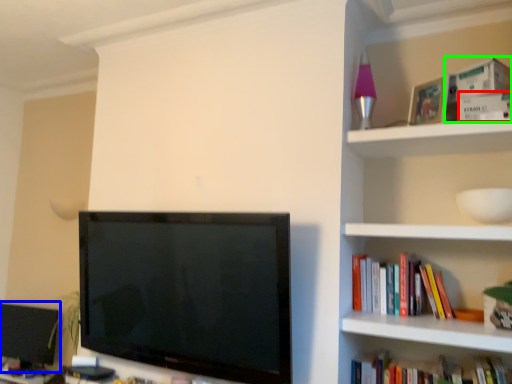
Question: Which object is positioned closest to paperback book (highlighted by a red box)? Select from computer monitor (highlighted by a blue box) and paperback book (highlighted by a green box).

Choices:
 (A) computer monitor
 (B) paperback book

Answer: (B)